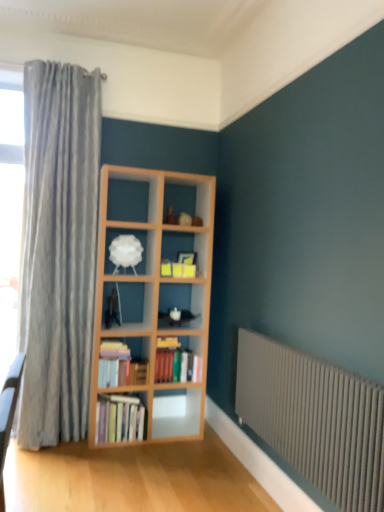
Question: Is hardcover books at center, which is the third book from top to bottom, to the left or to the right of hardcover books at center, acting as the 2th book starting from the bottom, in the image?

Choices:
 (A) left
 (B) right

Answer: (A)

Question: From a real-world perspective, is hardcover books at center, which is the third book from top to bottom, above or below hardcover books at center, placed as the second book when sorted from top to bottom?

Choices:
 (A) below
 (B) above

Answer: (A)

Question: Which of these objects is positioned closest to the hardcover books at center, arranged as the first book when ordered from the bottom?

Choices:
 (A) hardcover books at center-left, the 3th book positioned from the bottom
 (B) hardcover books at center, acting as the 2th book starting from the bottom
 (C) gray metallic radiator at lower right
 (D) white matte lampshade at center

Answer: (A)

Question: Estimate the real-world distances between objects in this image. Which object is farther from the gray metallic radiator at lower right?

Choices:
 (A) hardcover books at center-left, the 3th book positioned from the bottom
 (B) hardcover books at center, acting as the 2th book starting from the bottom
 (C) hardcover books at center, arranged as the first book when ordered from the bottom
 (D) white matte lampshade at center

Answer: (D)